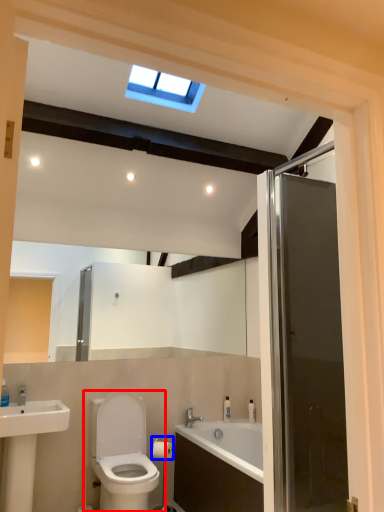
Question: Which object appears closest to the camera in this image, toilet (highlighted by a red box) or towel bar (highlighted by a blue box)?

Choices:
 (A) toilet
 (B) towel bar

Answer: (A)